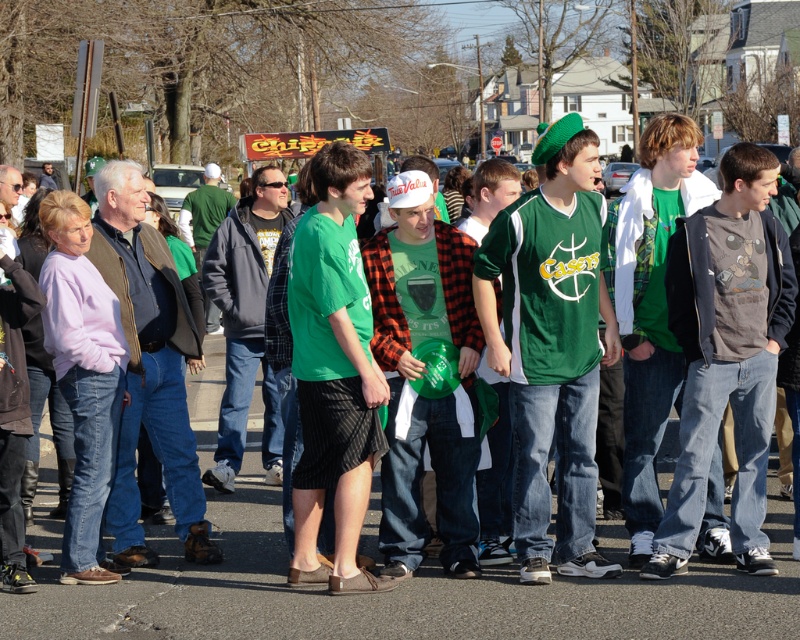
Between green fabric shirt at center and green plaid shirt at center, which one appears on the right side from the viewer's perspective?

From the viewer's perspective, green plaid shirt at center appears more on the right side.

Which is behind, point (345, 536) or point (432, 291)?

The point (432, 291) is more distant.

Is point (292, 282) closer to camera compared to point (472, 248)?

Yes, point (292, 282) is in front of point (472, 248).

The height and width of the screenshot is (640, 800). I want to click on green fabric shirt at center, so (333, 372).

Locate an element on the screen. green jersey at center is located at coordinates (552, 348).

Between green jersey at center and dark gray cotton t-shirt at center, which one is positioned lower?

dark gray cotton t-shirt at center is below.

Identify the location of green jersey at center. (552, 348).

Where is `green jersey at center`? The height and width of the screenshot is (640, 800). green jersey at center is located at coordinates pyautogui.click(x=552, y=348).

At what (x,y) coordinates should I click in order to perform the action: click on green jersey at center. Please return your answer as a coordinate pair (x, y). Image resolution: width=800 pixels, height=640 pixels. Looking at the image, I should click on (552, 348).

Is point (578, 147) more distant than point (397, 544)?

No, it is in front of (397, 544).

Is point (536, 518) positioned behind point (456, 424)?

No, it is not.

Image resolution: width=800 pixels, height=640 pixels. I want to click on green jersey at center, so point(552,348).